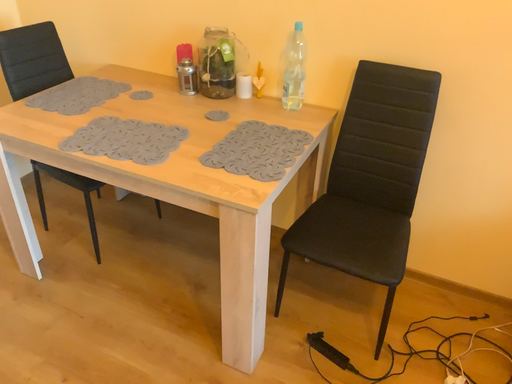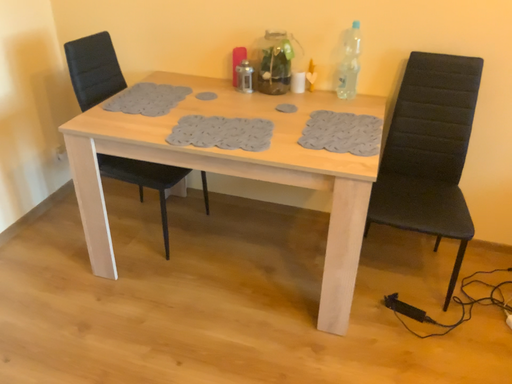
Question: Which way did the camera rotate in the video?

Choices:
 (A) rotated right
 (B) rotated left

Answer: (A)